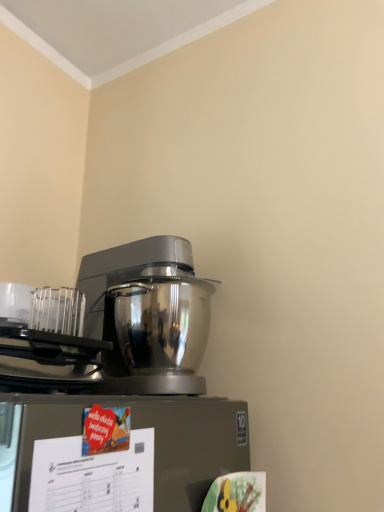
Question: Would you say satin silver mixer at center is to the left or to the right of brushed metal stand mixer at left in the picture?

Choices:
 (A) right
 (B) left

Answer: (A)

Question: Is point (125, 380) positioned closer to the camera than point (33, 380)?

Choices:
 (A) closer
 (B) farther

Answer: (B)

Question: Relative to brushed metal stand mixer at left, is satin silver mixer at center in front or behind?

Choices:
 (A) behind
 (B) front

Answer: (A)

Question: In terms of height, does brushed metal stand mixer at left look taller or shorter compared to satin silver mixer at center?

Choices:
 (A) tall
 (B) short

Answer: (B)

Question: From the image's perspective, is brushed metal stand mixer at left above or below satin silver mixer at center?

Choices:
 (A) above
 (B) below

Answer: (B)

Question: Is brushed metal stand mixer at left bigger or smaller than satin silver mixer at center?

Choices:
 (A) big
 (B) small

Answer: (B)

Question: Choose the correct answer: Is brushed metal stand mixer at left inside satin silver mixer at center or outside it?

Choices:
 (A) inside
 (B) outside

Answer: (B)